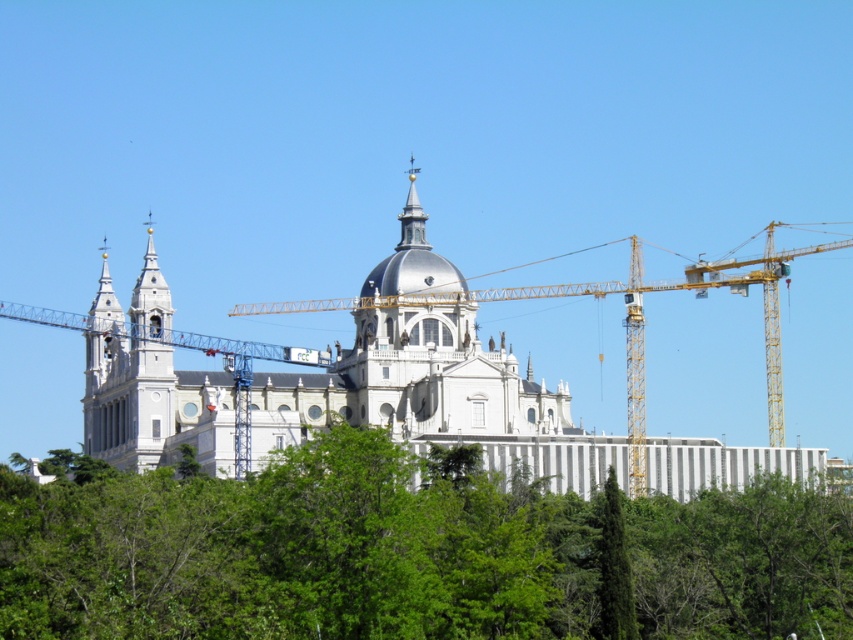
Does white stone church at center have a larger size compared to polished silver spire at center?

Yes.

Which of these two, white stone church at center or polished silver spire at center, stands shorter?

Standing shorter between the two is polished silver spire at center.

Which is in front, point (412, 433) or point (413, 209)?

Point (412, 433)

Locate an element on the screen. The height and width of the screenshot is (640, 853). white stone church at center is located at coordinates (436, 396).

Can you confirm if green leafy tree at center is wider than polished silver spire at center?

Yes.

Between point (238, 577) and point (410, 161), which one is positioned in front?

Point (238, 577) is more forward.

Locate an element on the screen. This screenshot has height=640, width=853. green leafy tree at center is located at coordinates (300, 550).

Identify the location of green leafy tree at center. (300, 550).

Does point (386, 436) lie in front of point (631, 630)?

Yes, it is in front of point (631, 630).

Does green leafy tree at center appear on the right side of green leafy tree at lower right?

Incorrect, green leafy tree at center is not on the right side of green leafy tree at lower right.

The width and height of the screenshot is (853, 640). Find the location of `green leafy tree at center`. green leafy tree at center is located at coordinates (300, 550).

This screenshot has width=853, height=640. In order to click on green leafy tree at center in this screenshot , I will do `click(300, 550)`.